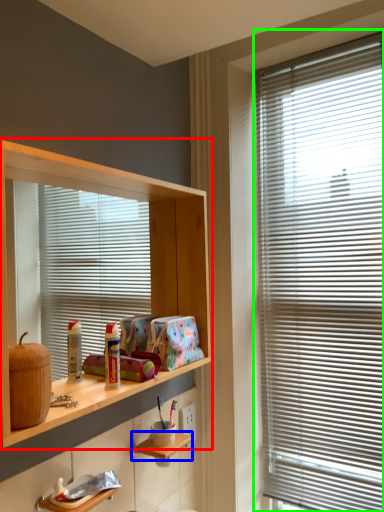
Question: Which object is the closest to the shelf (highlighted by a red box)? Choose among these: shelf (highlighted by a blue box) or window blind (highlighted by a green box).

Choices:
 (A) shelf
 (B) window blind

Answer: (B)